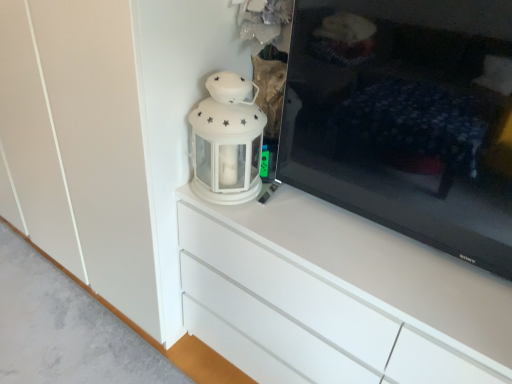
Question: Can you confirm if white glossy chest of drawers at center is bigger than white glossy lantern at upper center?

Choices:
 (A) yes
 (B) no

Answer: (A)

Question: Does white glossy chest of drawers at center have a lesser width compared to white glossy lantern at upper center?

Choices:
 (A) yes
 (B) no

Answer: (B)

Question: Considering the relative sizes of white glossy chest of drawers at center and white glossy lantern at upper center in the image provided, is white glossy chest of drawers at center wider than white glossy lantern at upper center?

Choices:
 (A) no
 (B) yes

Answer: (B)

Question: Is white glossy chest of drawers at center closer to the viewer compared to white glossy lantern at upper center?

Choices:
 (A) no
 (B) yes

Answer: (B)

Question: Does white glossy chest of drawers at center have a smaller size compared to white glossy lantern at upper center?

Choices:
 (A) yes
 (B) no

Answer: (B)

Question: Does white glossy chest of drawers at center appear on the right side of white glossy lantern at upper center?

Choices:
 (A) no
 (B) yes

Answer: (B)

Question: Is white glossy lantern at upper center aimed at white glossy chest of drawers at center?

Choices:
 (A) yes
 (B) no

Answer: (B)

Question: Is white glossy lantern at upper center smaller than white glossy chest of drawers at center?

Choices:
 (A) no
 (B) yes

Answer: (B)

Question: From a real-world perspective, is white glossy lantern at upper center physically above white glossy chest of drawers at center?

Choices:
 (A) yes
 (B) no

Answer: (A)

Question: Can you confirm if white glossy lantern at upper center is shorter than white glossy chest of drawers at center?

Choices:
 (A) no
 (B) yes

Answer: (B)

Question: Is white glossy lantern at upper center positioned behind white glossy chest of drawers at center?

Choices:
 (A) no
 (B) yes

Answer: (B)

Question: From the image's perspective, is white glossy lantern at upper center located beneath white glossy chest of drawers at center?

Choices:
 (A) no
 (B) yes

Answer: (A)

Question: Can you confirm if black glossy tv at right is taller than white glossy lantern at upper center?

Choices:
 (A) no
 (B) yes

Answer: (B)